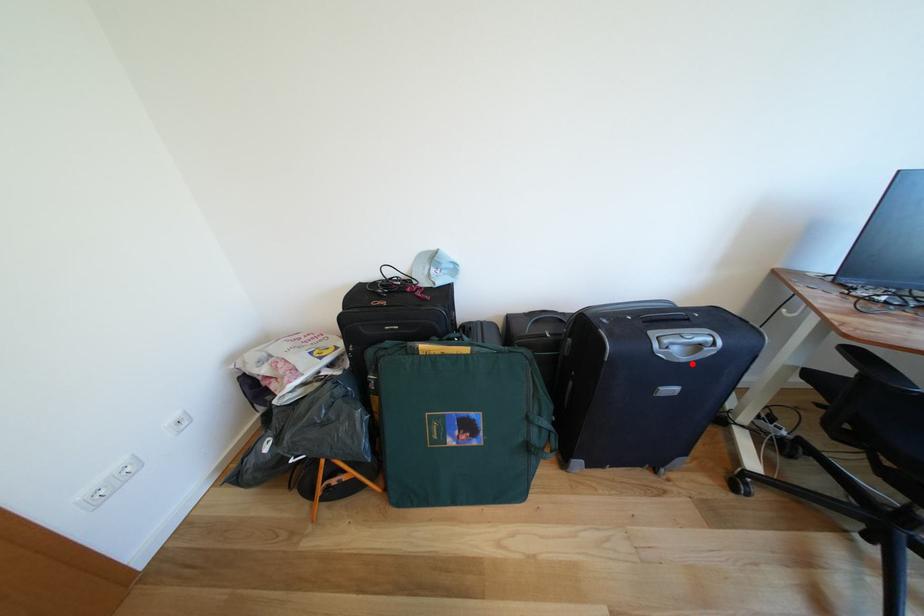
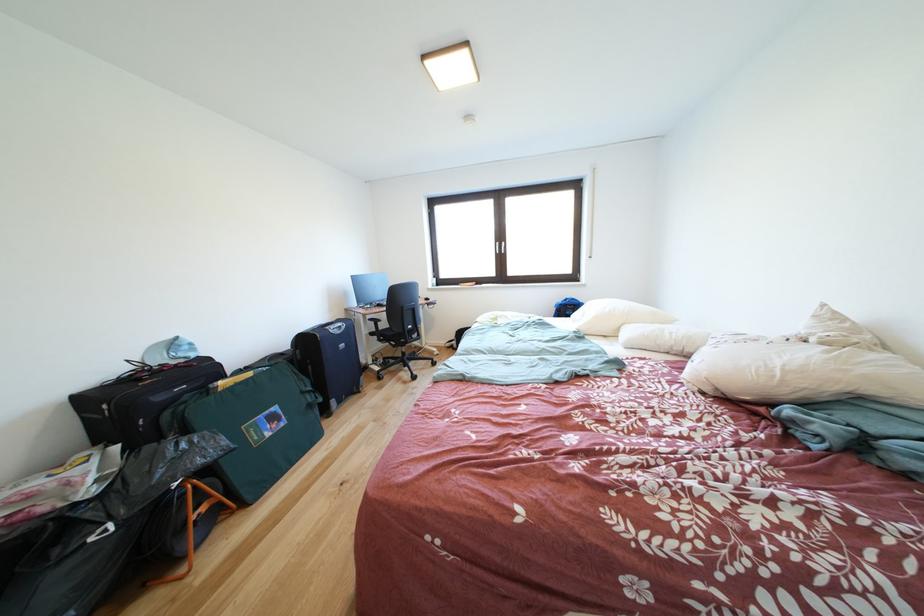
Question: I am providing you with two images of the same scene from different viewpoints. A red point is shown in image1. For the corresponding object point in image2, is it positioned nearer or farther from the camera?

Choices:
 (A) Nearer
 (B) Farther

Answer: (A)